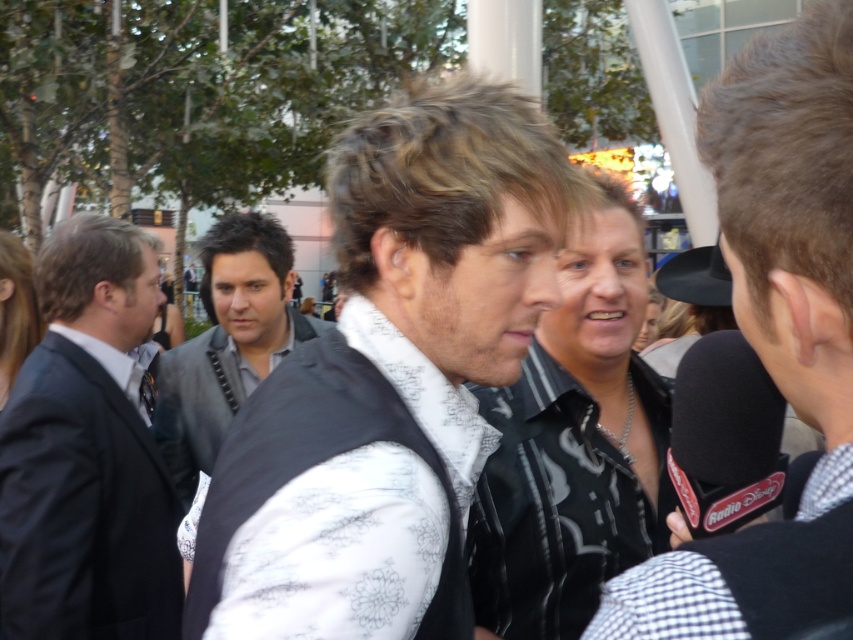
You are a photographer at a social event and want to capture both the dark gray suit at left and the dark gray textured vest at center in a single frame. Based on their heights, which one will appear taller in the photo?

The dark gray suit at left appears taller in the photo because it has a greater height compared to the dark gray textured vest at center.

You are standing in the scene and want to hand a small item to the person wearing the white textured vest at center. If you are currently 1.5 meters away from the vest, can you reach them without moving closer? Please explain.

The white textured vest at center and the viewer are 1.24 meters apart from each other. Since you are 1.5 meters away from the vest, you are farther than the required distance. Therefore, you cannot reach them without moving closer.

Based on the photo, you are a photographer at the event and want to capture a photo that includes both the dark gray suit at left and the dark gray textured vest at center. To ensure both are in frame, should you adjust your camera to focus more to the left or the right?

The dark gray suit at left is positioned on the left side of the dark gray textured vest at center, so focusing more to the left will ensure both are in frame.